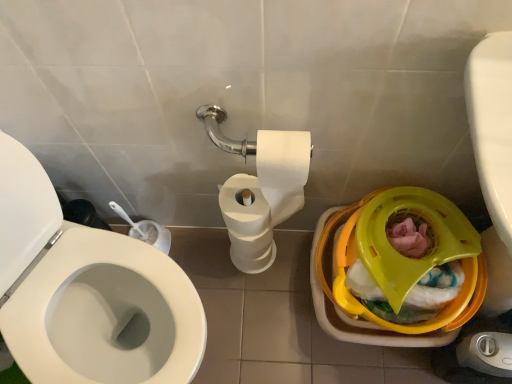
Question: Is point tap(260, 137) positioned closer to the camera than point tap(458, 306)?

Choices:
 (A) closer
 (B) farther

Answer: (A)

Question: Is white matte toilet paper at center in front of or behind yellow plastic potty at lower right in the image?

Choices:
 (A) behind
 (B) front

Answer: (A)

Question: Which is correct: white matte toilet paper at center is inside yellow plastic potty at lower right, or outside of it?

Choices:
 (A) outside
 (B) inside

Answer: (A)

Question: In terms of height, does yellow plastic potty at lower right look taller or shorter compared to white matte toilet paper at center?

Choices:
 (A) short
 (B) tall

Answer: (A)

Question: In the image, is yellow plastic potty at lower right on the left side or the right side of white matte toilet paper at center?

Choices:
 (A) right
 (B) left

Answer: (A)

Question: From the image's perspective, is yellow plastic potty at lower right above or below white matte toilet paper at center?

Choices:
 (A) above
 (B) below

Answer: (B)

Question: Choose the correct answer: Is yellow plastic potty at lower right inside white matte toilet paper at center or outside it?

Choices:
 (A) outside
 (B) inside

Answer: (A)